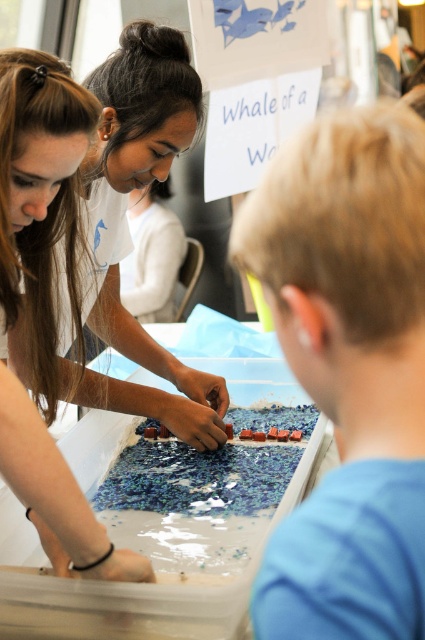
Question: Which point is farther from the camera taking this photo?

Choices:
 (A) (64, 275)
 (B) (312, 189)

Answer: (A)

Question: From the image, what is the correct spatial relationship of blue matte puzzle pieces at right in relation to matte white shirt at upper left?

Choices:
 (A) left
 (B) right

Answer: (B)

Question: Which point is closer to the camera taking this photo?

Choices:
 (A) (82, 166)
 (B) (376, 273)

Answer: (B)

Question: Does blue matte puzzle pieces at right have a greater width compared to matte white shirt at upper left?

Choices:
 (A) yes
 (B) no

Answer: (B)

Question: Can you confirm if blue matte puzzle pieces at right is bigger than matte white shirt at upper left?

Choices:
 (A) no
 (B) yes

Answer: (A)